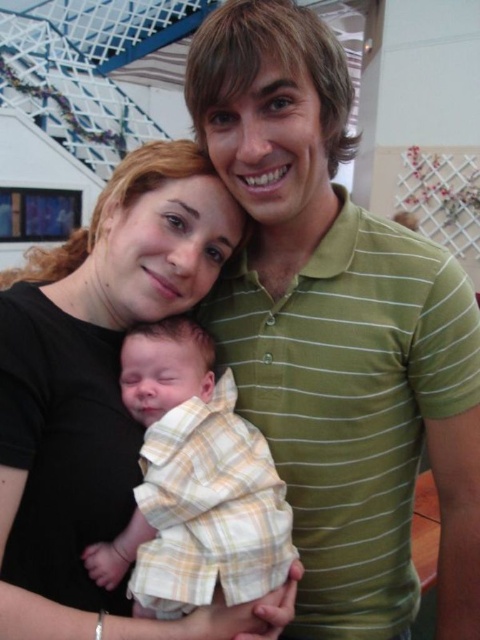
Question: Which object is the farthest from the yellow plaid shirt at center?

Choices:
 (A) black matte shirt at center
 (B) green striped polo shirt at center

Answer: (B)

Question: Which object appears closest to the camera in this image?

Choices:
 (A) yellow plaid shirt at center
 (B) green striped polo shirt at center

Answer: (B)

Question: Which object appears farthest from the camera in this image?

Choices:
 (A) black matte shirt at center
 (B) yellow plaid shirt at center
 (C) green striped polo shirt at center

Answer: (B)

Question: In this image, where is green striped polo shirt at center located relative to black matte shirt at center?

Choices:
 (A) below
 (B) above

Answer: (B)

Question: Can you confirm if green striped polo shirt at center is positioned below black matte shirt at center?

Choices:
 (A) yes
 (B) no

Answer: (B)

Question: Where is green striped polo shirt at center located in relation to yellow plaid shirt at center in the image?

Choices:
 (A) above
 (B) below

Answer: (A)